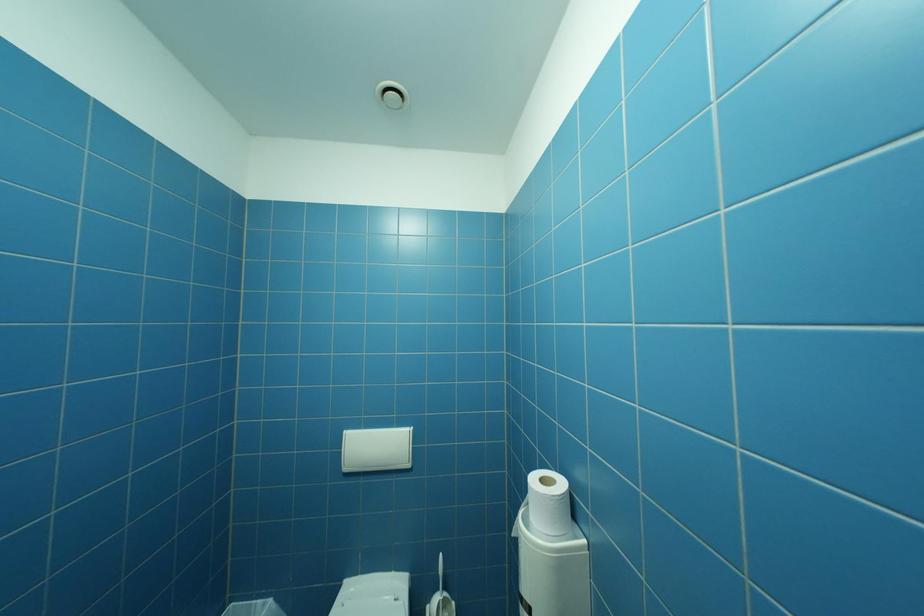
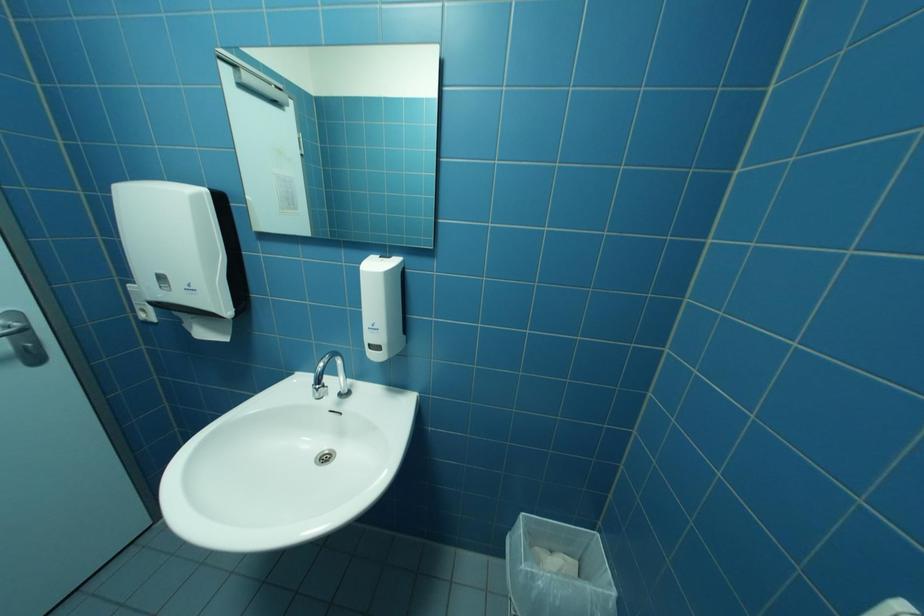
The first image is from the beginning of the video and the second image is from the end. How did the camera likely rotate when shooting the video?

The camera rotated toward left-down.